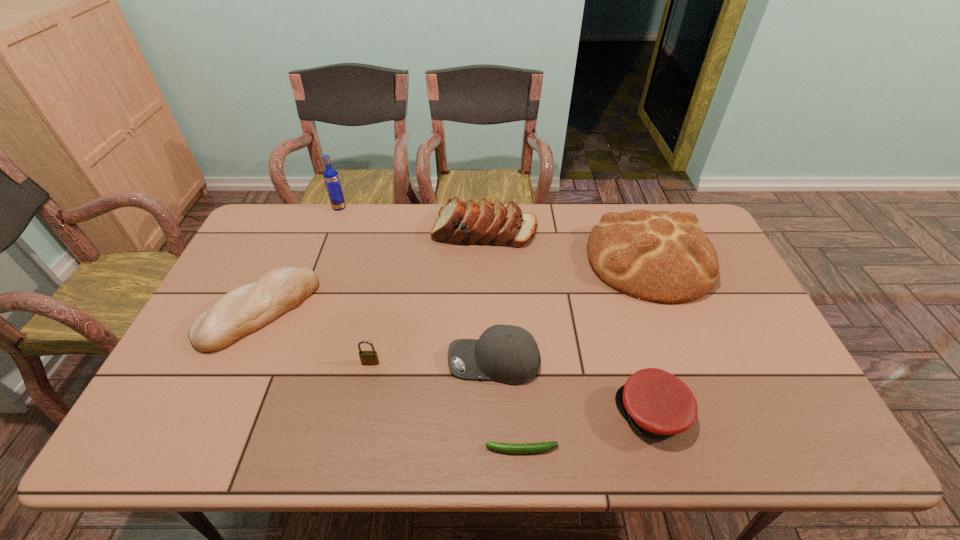
Identify the location of free space located 0.320m at the front of the cap where the visor is located. This screenshot has height=540, width=960. (484, 414).

At what (x,y) coordinates should I click in order to perform the action: click on vacant space situated 0.290m on the front-facing side of the zucchini. Please return your answer as a coordinate pair (x, y). Image resolution: width=960 pixels, height=540 pixels. Looking at the image, I should click on (357, 449).

This screenshot has height=540, width=960. What are the coordinates of `vacant space located 0.070m on the front-facing side of the zucchini` in the screenshot? It's located at (454, 449).

Locate an element on the screen. The width and height of the screenshot is (960, 540). vacant space located 0.070m on the front-facing side of the zucchini is located at coordinates (454, 449).

Identify the location of vodka that is at the far edge. The height and width of the screenshot is (540, 960). (330, 175).

You are a GUI agent. You are given a task and a screenshot of the screen. Output one action in this format:
    pyautogui.click(x=<x>, y=<y>)
    Task: Click on the cap located at the near edge
    
    Given the screenshot: What is the action you would take?
    pyautogui.click(x=657, y=403)

Where is `zucchini positioned at the near edge`? The width and height of the screenshot is (960, 540). zucchini positioned at the near edge is located at coordinates (519, 448).

In order to click on object that is at the left edge in this screenshot , I will do `click(247, 308)`.

You are a GUI agent. You are given a task and a screenshot of the screen. Output one action in this format:
    pyautogui.click(x=<x>, y=<y>)
    Task: Click on the object that is at the right edge
    The height and width of the screenshot is (540, 960).
    Given the screenshot: What is the action you would take?
    pyautogui.click(x=661, y=256)

The height and width of the screenshot is (540, 960). Find the location of `object that is at the far right corner`. object that is at the far right corner is located at coordinates (661, 256).